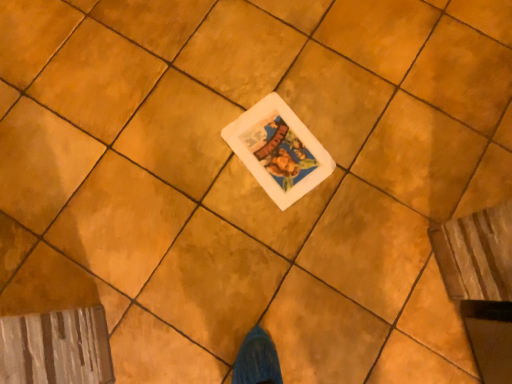
The width and height of the screenshot is (512, 384). I want to click on free space to the right of white matte comic book at center, so click(357, 160).